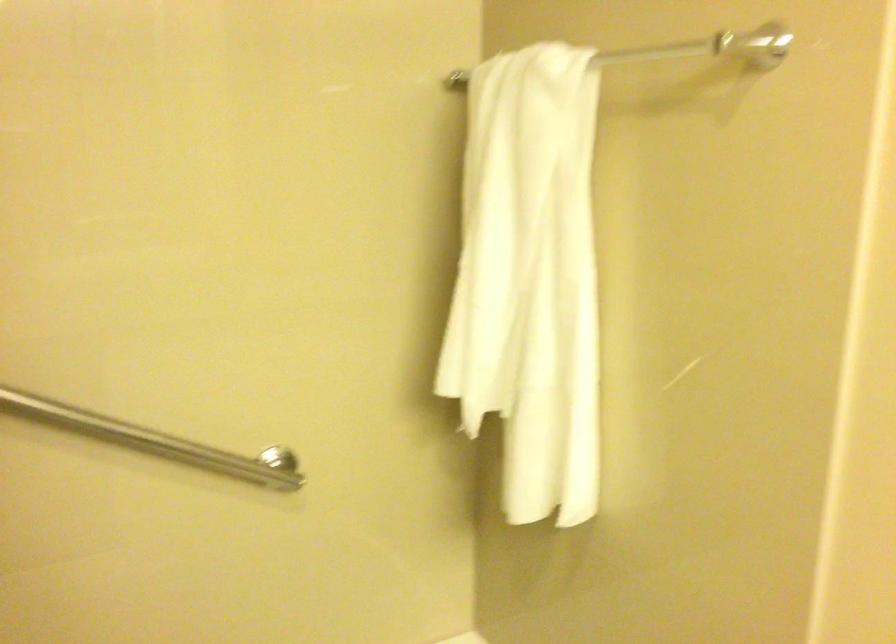
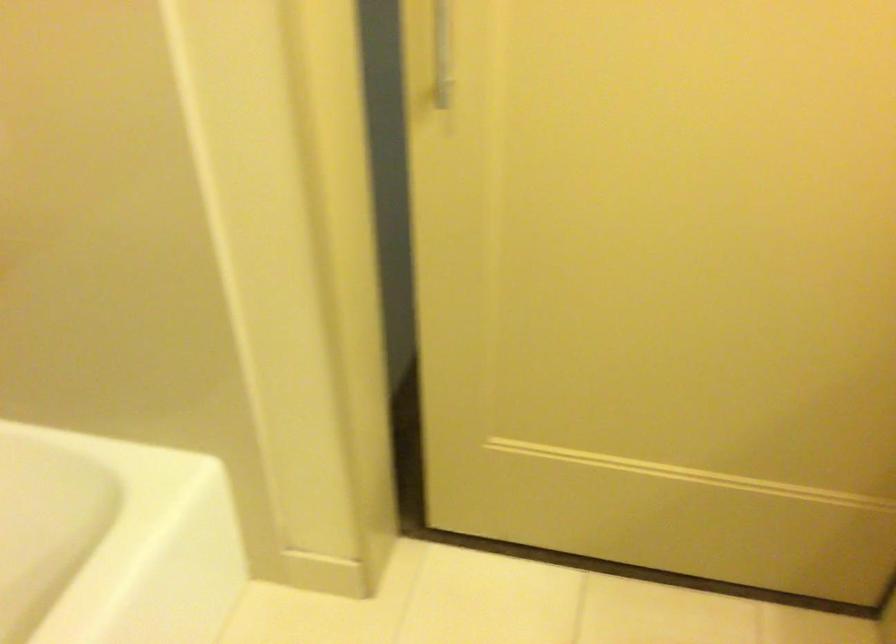
Based on the continuous images, in which direction is the camera rotating?

The camera rotated toward right-down.